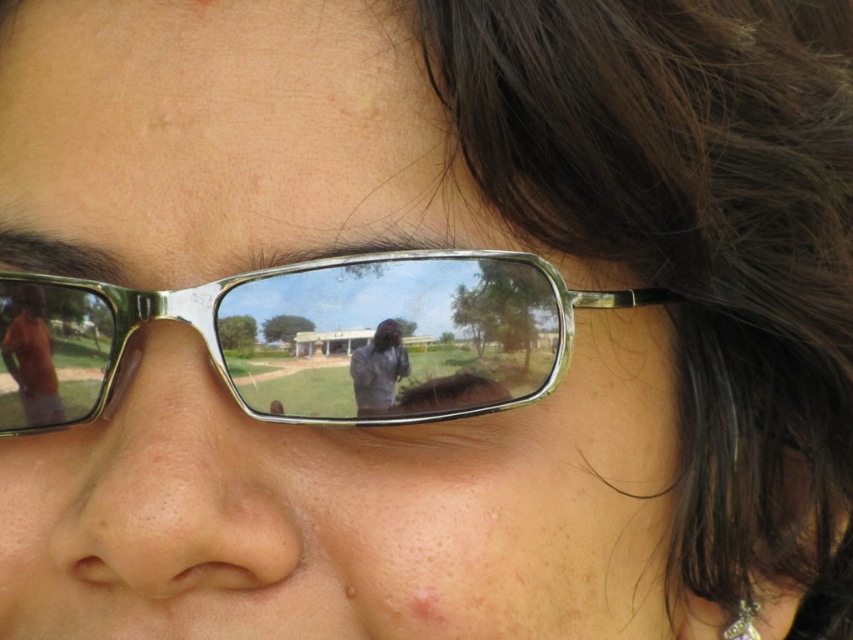
You are a photographer trying to capture a portrait of the person. Since the matte skin nose at center and the matte black shirt at center are both in the frame, which one will appear closer to the camera in the photo?

The matte skin nose at center will appear closer to the camera in the photo because it is in front of the matte black shirt at center.